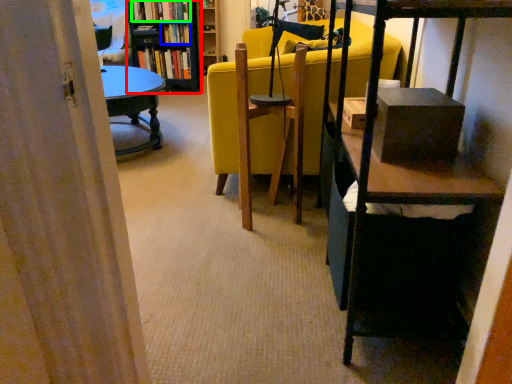
Question: Which is farther away from bookcase (highlighted by a red box)? book (highlighted by a blue box) or book (highlighted by a green box)?

Choices:
 (A) book
 (B) book

Answer: (B)